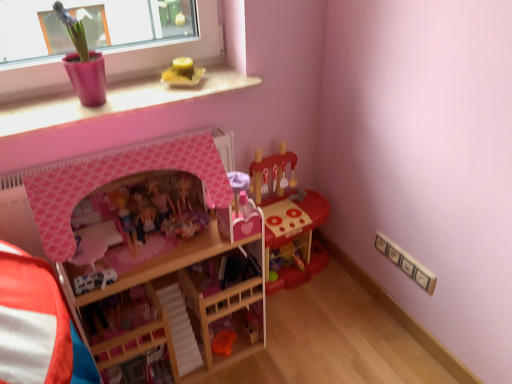
Where is `space that is in front of matte plastic play kitchen at center, which is the 1th toy from right to left`? Image resolution: width=512 pixels, height=384 pixels. space that is in front of matte plastic play kitchen at center, which is the 1th toy from right to left is located at coordinates (308, 322).